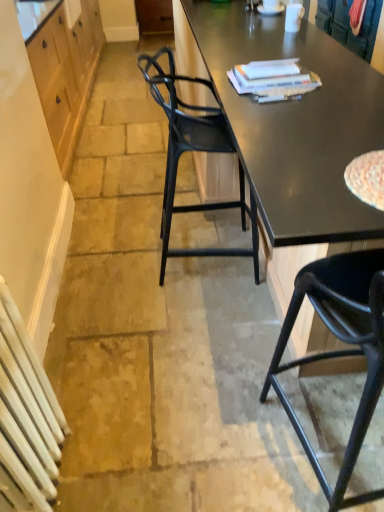
Locate an element on the screen. free space to the left of black plastic chair at center, acting as the 2th chair starting from the front is located at coordinates (126, 277).